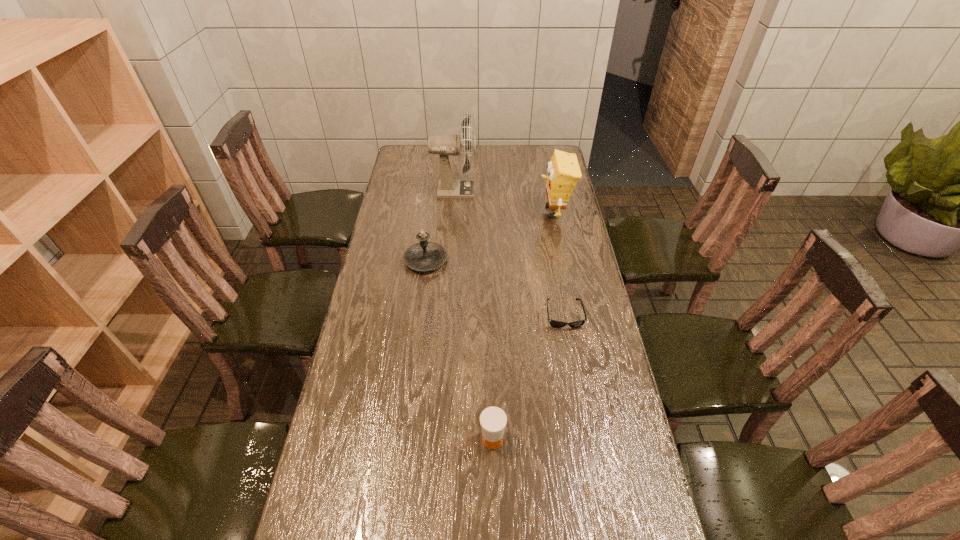
What are the coordinates of `free spot located 0.210m on the face of the second tallest object` in the screenshot? It's located at (488, 212).

This screenshot has height=540, width=960. I want to click on blank space located 0.270m on the face of the second tallest object, so click(x=474, y=212).

Locate an element on the screen. The width and height of the screenshot is (960, 540). vacant space situated 0.150m on the front of the third shortest object is located at coordinates (420, 307).

At what (x,y) coordinates should I click in order to perform the action: click on blank area located 0.280m on the label of the third object from left to right. Please return your answer as a coordinate pair (x, y). Image resolution: width=960 pixels, height=540 pixels. Looking at the image, I should click on (374, 438).

Locate an element on the screen. free space located on the label of the third object from left to right is located at coordinates (461, 438).

Identify the location of free space located 0.150m on the label of the third object from left to right. Image resolution: width=960 pixels, height=540 pixels. (423, 438).

In order to click on vacant area situated 0.180m on the front-facing side of the sunglasses in this screenshot , I will do `click(575, 379)`.

The height and width of the screenshot is (540, 960). I want to click on object that is at the left edge, so tap(424, 256).

This screenshot has width=960, height=540. Find the location of `sponge present at the right edge`. sponge present at the right edge is located at coordinates (x=563, y=172).

Where is `sunglasses that is at the right edge`? The image size is (960, 540). sunglasses that is at the right edge is located at coordinates (558, 324).